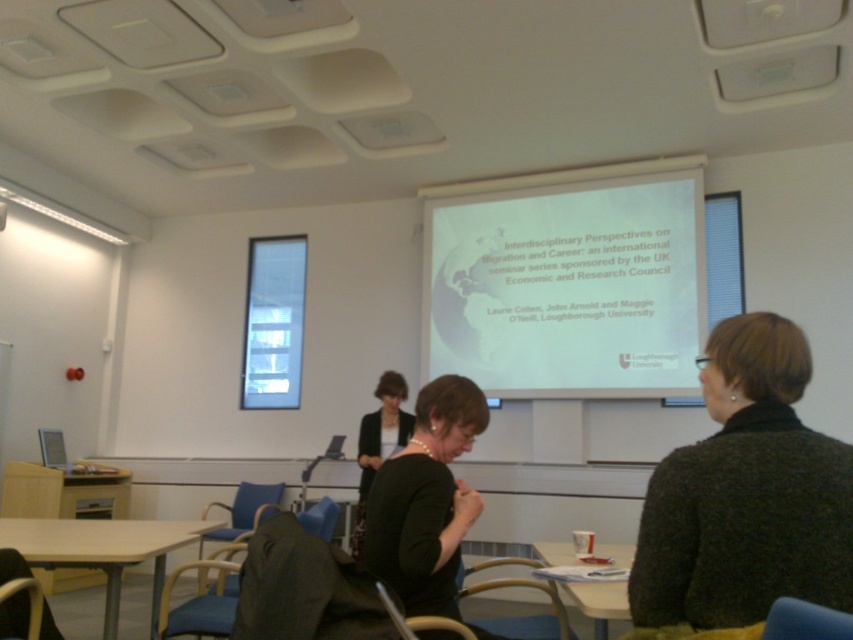
You are sitting at the light brown wooden table at lower left and want to hand a document to the person wearing the dark green sweater at center. In which direction should you move to reach them?

You should move to your right because the dark green sweater at center is to the right of the light brown wooden table at lower left.

You are setting up a presentation in the conference room. You have a laptop connected to the projector. To ensure the presentation is visible to everyone, you need to position the laptop so its output matches the screen size. Is the white matte projector screen at upper center wider than the dark green sweater at center?

The white matte projector screen at upper center might be wider than the dark green sweater at center according to the description.